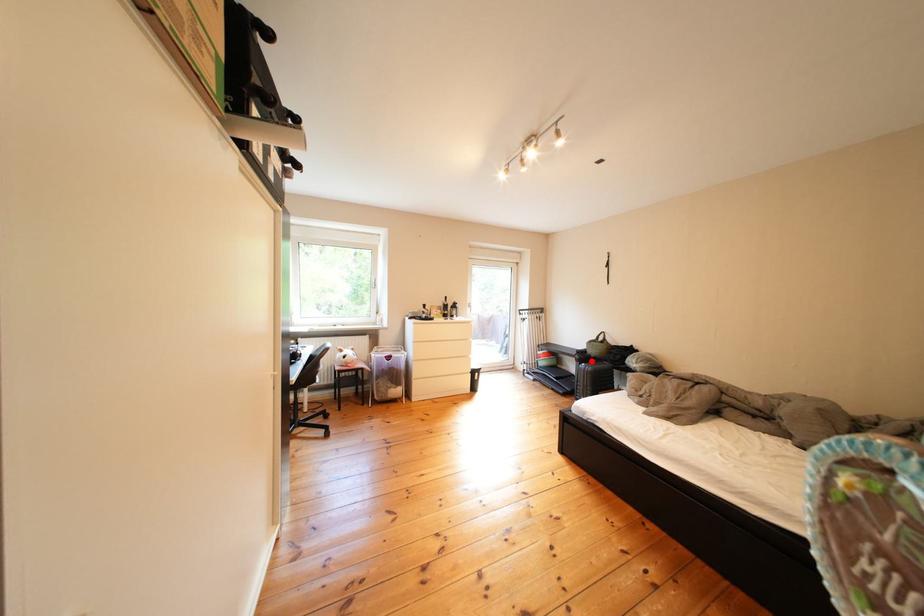
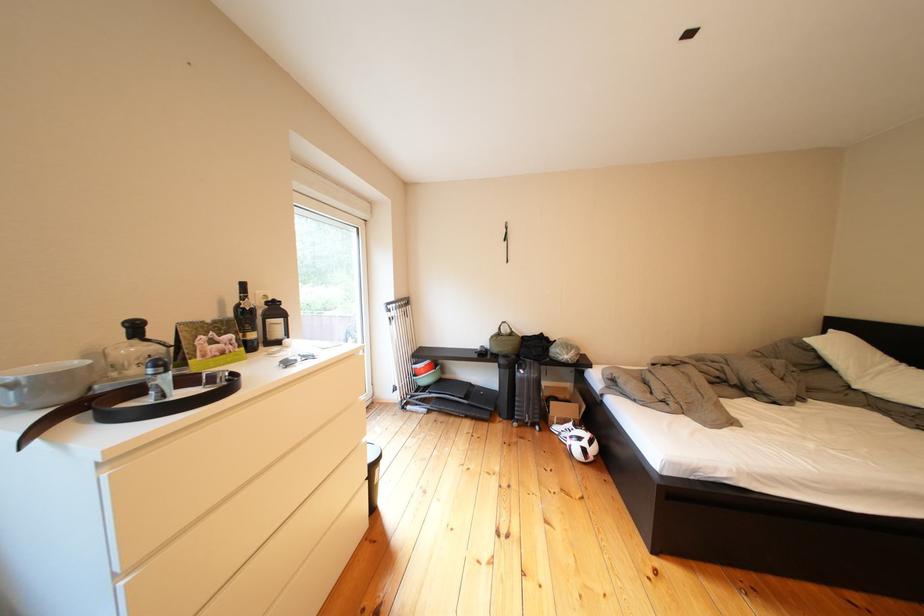
The point at the highlighted location is marked in the first image. Where is the corresponding point in the second image?

(516, 366)